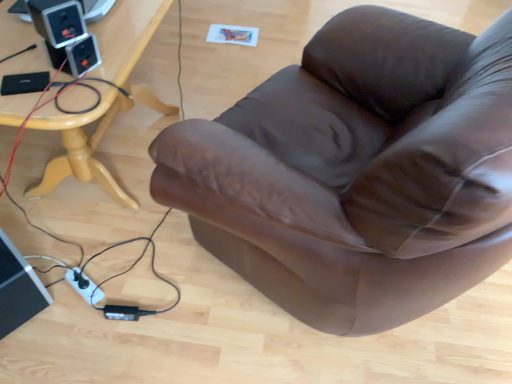
Describe the element at coordinates (81, 146) in the screenshot. I see `wooden table at left` at that location.

At what (x,y) coordinates should I click in order to perform the action: click on wooden table at left. Please return your answer as a coordinate pair (x, y). This screenshot has height=384, width=512. Looking at the image, I should click on (81, 146).

Identify the location of wooden table at left. The width and height of the screenshot is (512, 384). (81, 146).